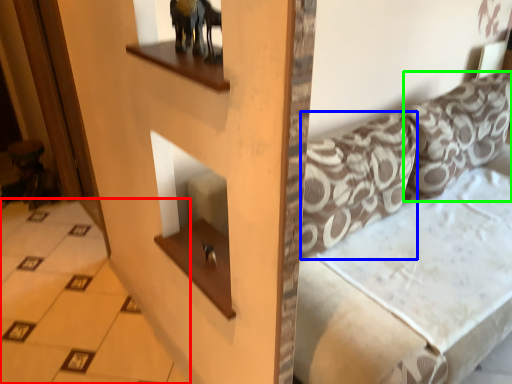
Question: Estimate the real-world distances between objects in this image. Which object is farther from tile (highlighted by a red box), pillow (highlighted by a blue box) or pillow (highlighted by a green box)?

Choices:
 (A) pillow
 (B) pillow

Answer: (B)